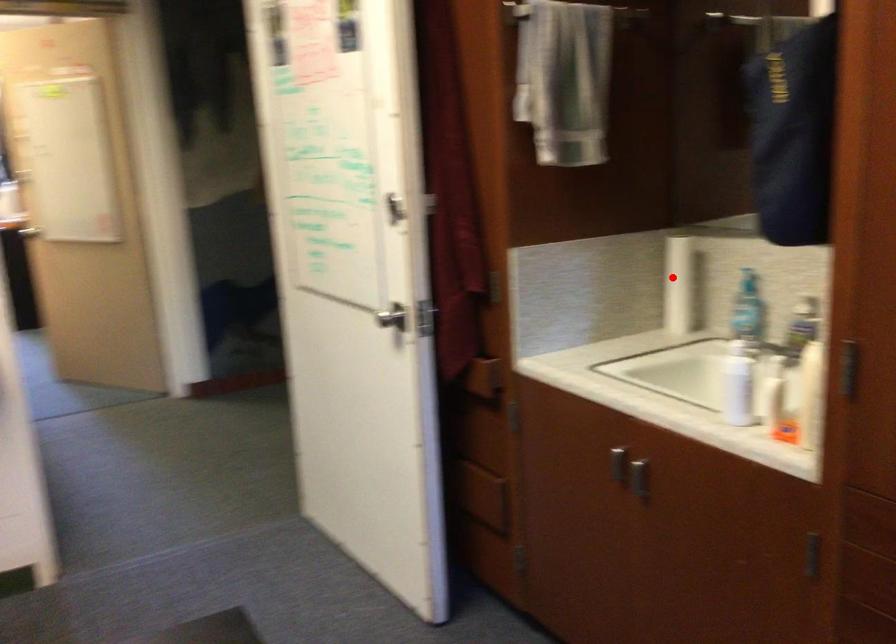
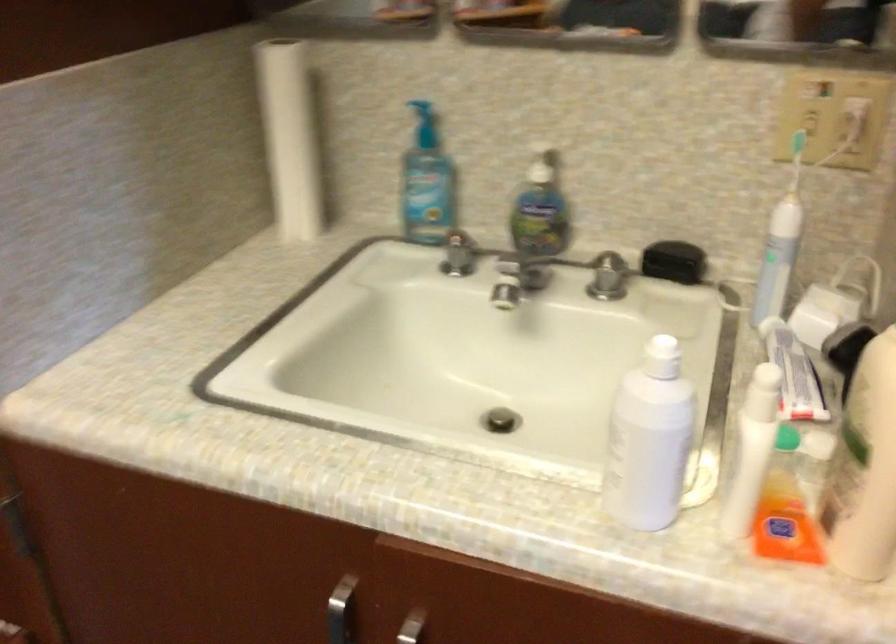
Question: I am providing you with two images of the same scene from different viewpoints. In image1, a red point is highlighted. Considering the same 3D point in image2, which of the following is correct?

Choices:
 (A) It is closer
 (B) It is farther

Answer: (A)